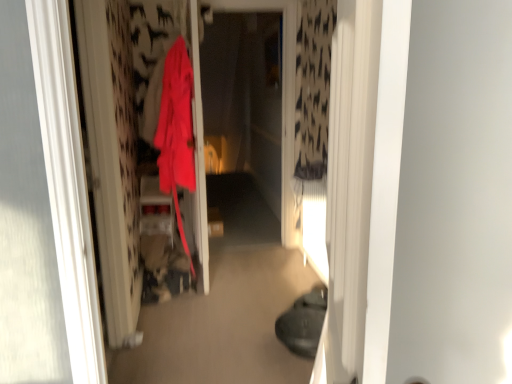
Question: From a real-world perspective, is matte red coat at center physically located above or below transparent plastic screen door at center?

Choices:
 (A) below
 (B) above

Answer: (A)

Question: From their relative heights in the image, would you say matte red coat at center is taller or shorter than transparent plastic screen door at center?

Choices:
 (A) short
 (B) tall

Answer: (A)

Question: Considering the positions of matte red coat at center and transparent plastic screen door at center in the image, is matte red coat at center wider or thinner than transparent plastic screen door at center?

Choices:
 (A) wide
 (B) thin

Answer: (A)

Question: From their relative heights in the image, would you say transparent plastic screen door at center is taller or shorter than matte red coat at center?

Choices:
 (A) tall
 (B) short

Answer: (A)

Question: Based on their sizes in the image, would you say transparent plastic screen door at center is bigger or smaller than matte red coat at center?

Choices:
 (A) big
 (B) small

Answer: (B)

Question: Is transparent plastic screen door at center in front of or behind matte red coat at center in the image?

Choices:
 (A) front
 (B) behind

Answer: (B)

Question: From a real-world perspective, is transparent plastic screen door at center above or below matte red coat at center?

Choices:
 (A) below
 (B) above

Answer: (B)